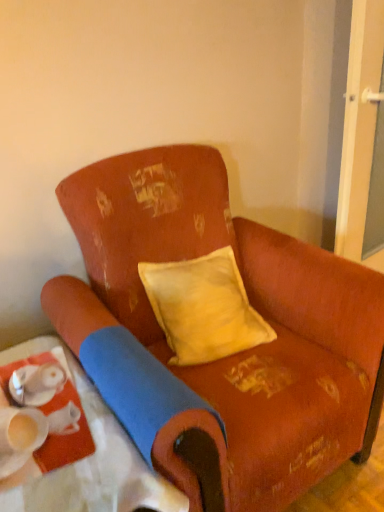
Identify the location of empty space that is ontop of matte white tray at lower left (from a real-world perspective). This screenshot has width=384, height=512. (56, 421).